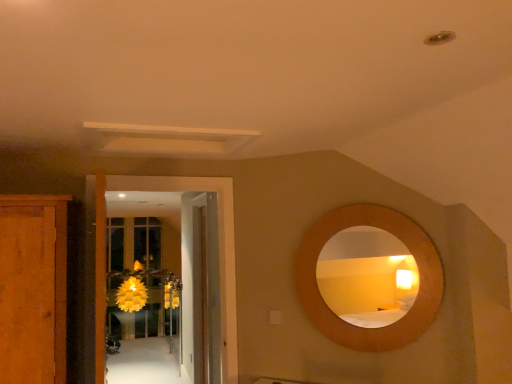
Question: In terms of height, does yellow paper flower at center look taller or shorter compared to white glossy door at center, which ranks as the 1th door in front-to-back order?

Choices:
 (A) short
 (B) tall

Answer: (A)

Question: From a real-world perspective, relative to white glossy door at center, the second door positioned from the back, is yellow paper flower at center vertically above or below?

Choices:
 (A) below
 (B) above

Answer: (A)

Question: Which object is the farthest from the translucent yellow glass door at center?

Choices:
 (A) yellow paper flower at center
 (B) wooden door at center, arranged as the 2th door when viewed from the front
 (C) wooden cabinet at left
 (D) white glossy door at center, which ranks as the 1th door in front-to-back order
 (E) wooden circular mirror at upper right

Answer: (E)

Question: Which is nearer to the translucent yellow glass door at center?

Choices:
 (A) yellow paper flower at center
 (B) wooden cabinet at left
 (C) wooden door at center, arranged as the 2th door when viewed from the front
 (D) white glossy door at center, the second door positioned from the back
 (E) wooden circular mirror at upper right

Answer: (A)